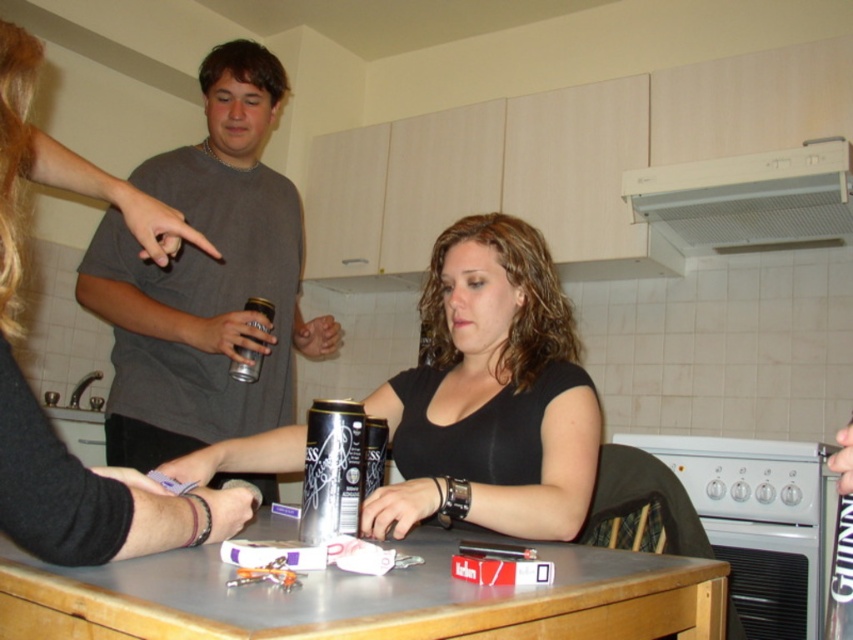
Question: From the image, what is the correct spatial relationship of silver metallic can at center in relation to metallic can at center?

Choices:
 (A) right
 (B) left

Answer: (A)

Question: Which point is closer to the camera?

Choices:
 (A) (596, 595)
 (B) (167, 330)
 (C) (252, 324)
 (D) (200, 477)

Answer: (A)

Question: Which of the following is the closest to the observer?

Choices:
 (A) silver metallic can at center
 (B) metallic can at center
 (C) matte gray shirt at left
 (D) metallic gray table at center

Answer: (D)

Question: Considering the relative positions of metallic gray table at center and metallic can at center in the image provided, where is metallic gray table at center located with respect to metallic can at center?

Choices:
 (A) below
 (B) above

Answer: (A)

Question: Does matte gray shirt at left have a lesser width compared to metallic can at center?

Choices:
 (A) no
 (B) yes

Answer: (A)

Question: Considering the real-world distances, which object is farthest from the metallic gray table at center?

Choices:
 (A) metallic can at center
 (B) silver metallic can at center
 (C) matte gray shirt at left

Answer: (A)